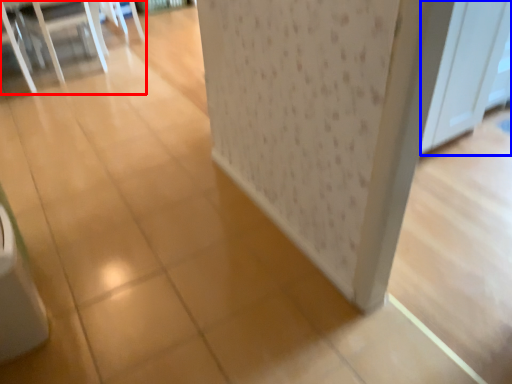
Question: Among these objects, which one is nearest to the camera, furniture (highlighted by a red box) or screen door (highlighted by a blue box)?

Choices:
 (A) furniture
 (B) screen door

Answer: (B)